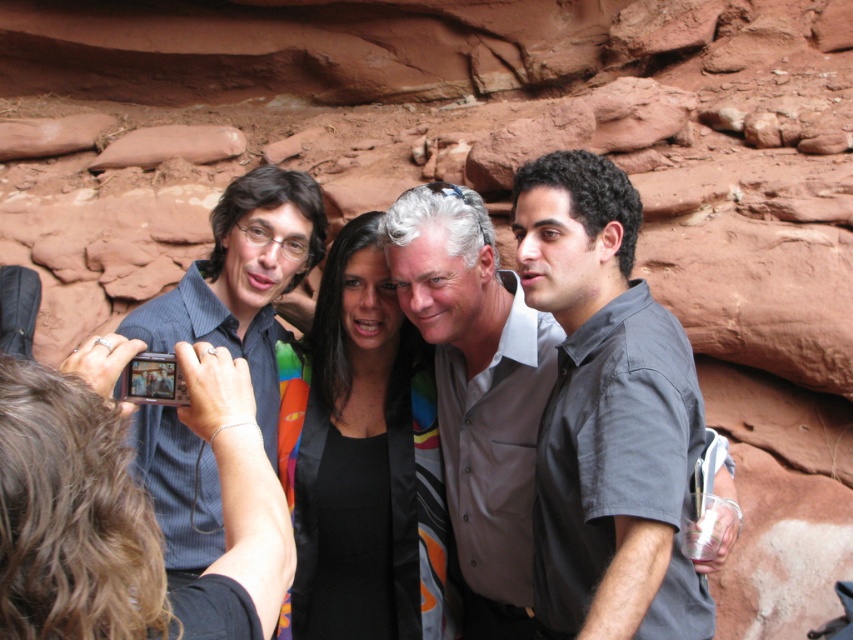
You are a photographer trying to frame a group photo. You notice two people in the group wearing shirts labeled as gray matte shirt at center and blue striped shirt at left. Which shirt is positioned more to the left?

The blue striped shirt at left is positioned more to the left than the gray matte shirt at center.

You are a photographer trying to adjust the focus of your camera to capture the gray matte shirt at center clearly. Based on the coordinates provided in the scene description, where should you aim the focus point of your camera?

The gray matte shirt at center is located at point (477, 390), so you should aim the focus point of your camera at those coordinates to capture it clearly.